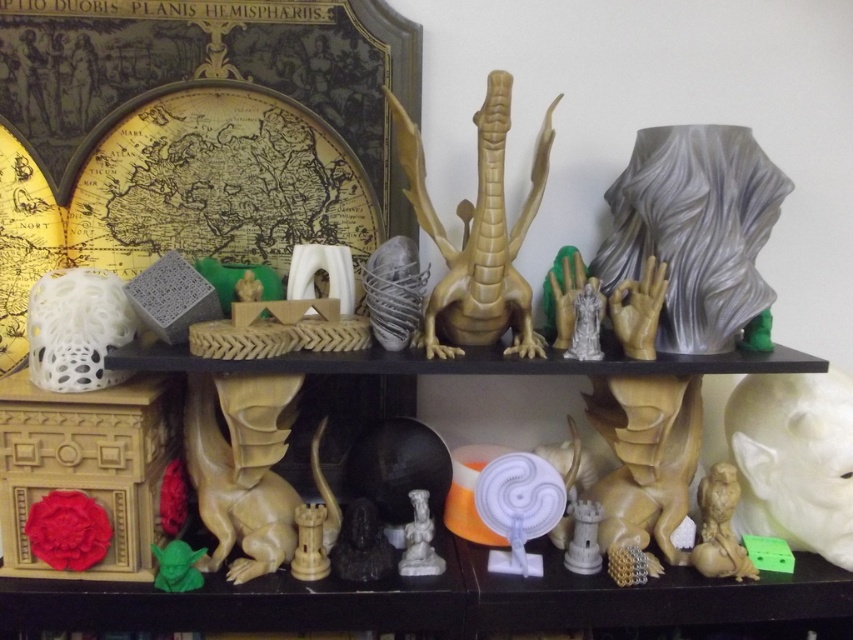
In the scene shown: Does gray matte sculpture at upper right appear over green matte yoda head at lower left?

Yes, gray matte sculpture at upper right is above green matte yoda head at lower left.

Between gray matte sculpture at upper right and green matte yoda head at lower left, which one appears on the right side from the viewer's perspective?

From the viewer's perspective, gray matte sculpture at upper right appears more on the right side.

Is point (637, 241) closer to viewer compared to point (199, 572)?

That is False.

What are the coordinates of `gray matte sculpture at upper right` in the screenshot? It's located at tap(695, 230).

Can you confirm if white matte bird at lower right is taller than matte brown owl at lower right?

Yes.

Is white matte bird at lower right to the left of matte brown owl at lower right from the viewer's perspective?

Incorrect, white matte bird at lower right is not on the left side of matte brown owl at lower right.

Is point (740, 483) behind point (735, 502)?

That is True.

The height and width of the screenshot is (640, 853). In order to click on white matte bird at lower right in this screenshot , I will do (793, 460).

Measure the distance between white matte bird at lower right and camera.

white matte bird at lower right is 1.28 meters from camera.

Looking at this image, who is shorter, white matte bird at lower right or white glossy statue at center?

Standing shorter between the two is white glossy statue at center.

Is point (846, 496) behind point (415, 513)?

Yes.

At what (x,y) coordinates should I click in order to perform the action: click on white matte bird at lower right. Please return your answer as a coordinate pair (x, y). This screenshot has height=640, width=853. Looking at the image, I should click on (793, 460).